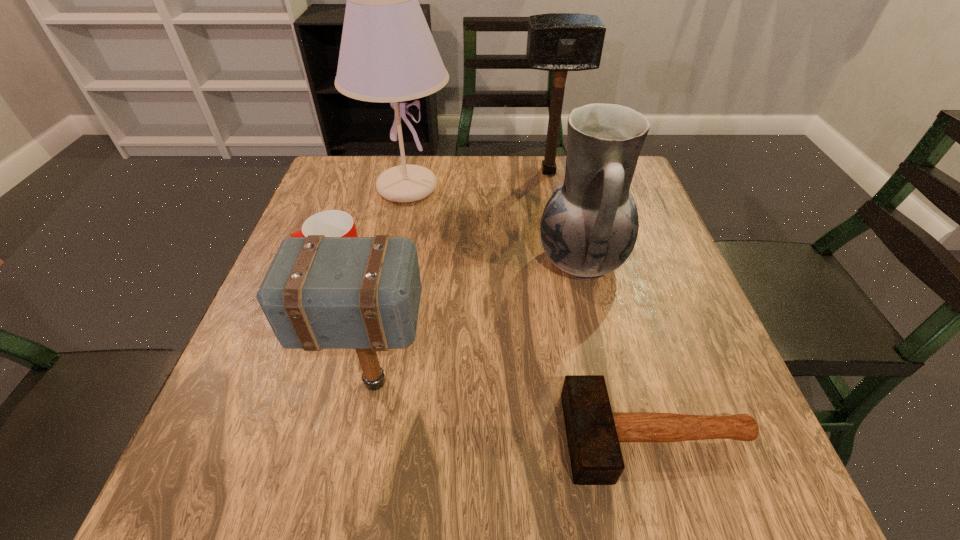
Where is `vacant area at the near left corner of the desktop`? The width and height of the screenshot is (960, 540). vacant area at the near left corner of the desktop is located at coordinates (184, 504).

Identify the location of vacant region at the near right corner. The image size is (960, 540). (676, 485).

The height and width of the screenshot is (540, 960). In order to click on empty space between the pitcher and the shortest mallet in this screenshot , I will do `click(619, 349)`.

Locate an element on the screen. free space between the shortest object and the tallest object is located at coordinates (532, 312).

Locate an element on the screen. free space between the shortest mallet and the lampshade is located at coordinates (532, 312).

At what (x,y) coordinates should I click in order to perform the action: click on vacant area between the third shortest object and the pitcher. Please return your answer as a coordinate pair (x, y). This screenshot has height=540, width=960. Looking at the image, I should click on (478, 322).

Locate an element on the screen. This screenshot has height=540, width=960. free point between the shortest mallet and the fifth tallest object is located at coordinates (494, 354).

I want to click on vacant space that's between the tallest mallet and the shortest mallet, so click(x=603, y=304).

You are a GUI agent. You are given a task and a screenshot of the screen. Output one action in this format:
    pyautogui.click(x=<x>, y=<y>)
    Task: Click on the blank region between the shortest mallet and the lampshade
    The width and height of the screenshot is (960, 540).
    Given the screenshot: What is the action you would take?
    pyautogui.click(x=532, y=312)

Find the location of a particular element. Image resolution: width=960 pixels, height=540 pixels. unoccupied position between the cup and the pitcher is located at coordinates (457, 267).